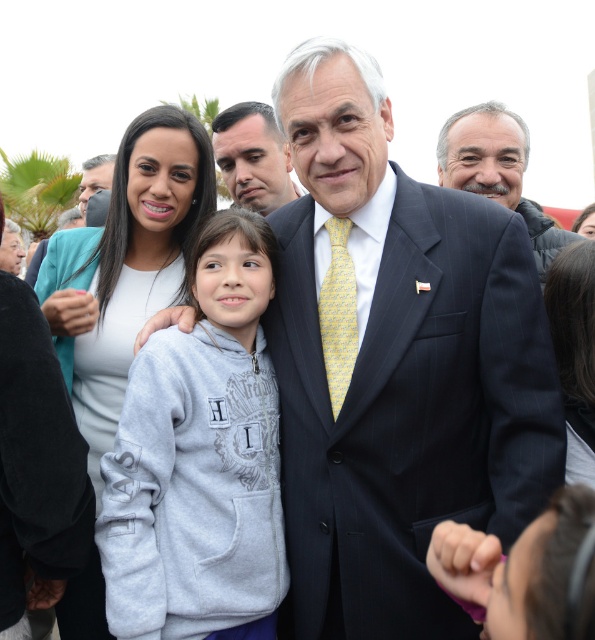
Question: Which object is closer to the camera taking this photo?

Choices:
 (A) dark gray suit at center
 (B) matte teal blazer at upper left

Answer: (A)

Question: Is dark blue pinstripe suit at center wider than yellow printed tie at center?

Choices:
 (A) yes
 (B) no

Answer: (A)

Question: Which point appears closest to the camera in this image?

Choices:
 (A) (136, 232)
 (B) (270, 134)
 (C) (271, 456)
 (D) (349, 378)

Answer: (D)

Question: Does gray fleece hoodie at center appear on the right side of smooth skin face at center?

Choices:
 (A) no
 (B) yes

Answer: (A)

Question: Which point is closer to the camera?

Choices:
 (A) (491, 141)
 (B) (336, 320)
 (C) (173, 273)
 (D) (434, 422)

Answer: (D)

Question: Is gray fleece hoodie at center bigger than matte teal blazer at upper left?

Choices:
 (A) yes
 (B) no

Answer: (B)